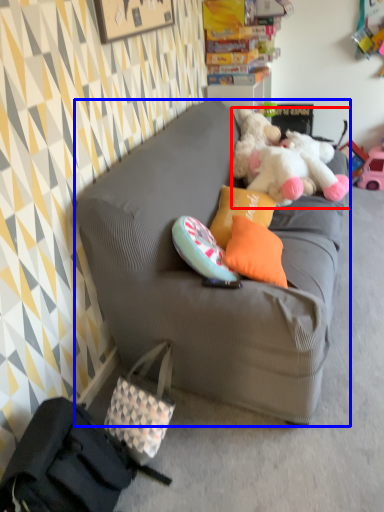
Question: Which of the following is the farthest to the observer, teddy bear (highlighted by a red box) or studio couch (highlighted by a blue box)?

Choices:
 (A) teddy bear
 (B) studio couch

Answer: (A)